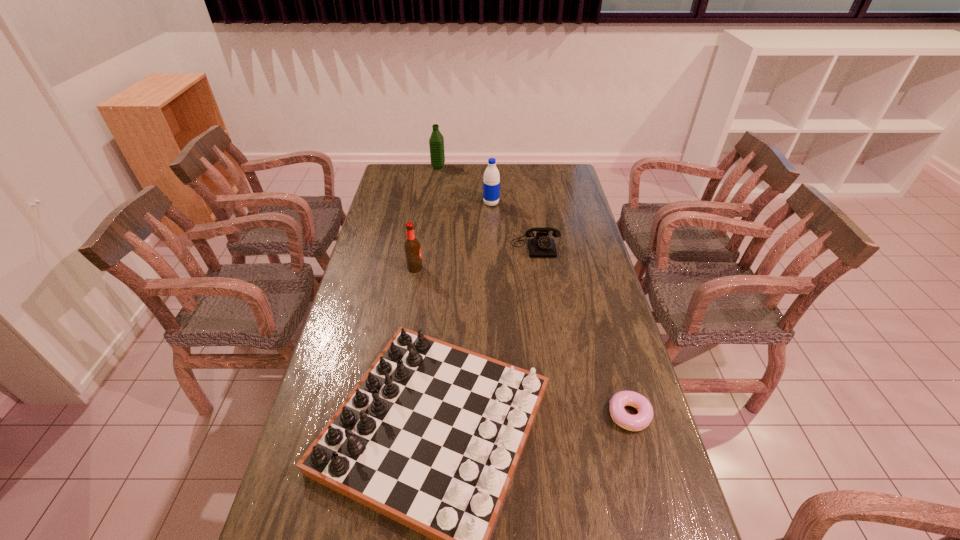
This screenshot has height=540, width=960. In order to click on the farther water bottle in this screenshot , I will do `click(436, 142)`.

This screenshot has height=540, width=960. I want to click on the farthest object, so click(x=436, y=142).

The width and height of the screenshot is (960, 540). I want to click on the nearer water bottle, so click(491, 184).

At what (x,y) coordinates should I click in order to perform the action: click on the right water bottle. Please return your answer as a coordinate pair (x, y). Looking at the image, I should click on (491, 184).

I want to click on the third nearest object, so click(x=412, y=247).

This screenshot has width=960, height=540. What are the coordinates of `telephone` in the screenshot? It's located at (541, 246).

This screenshot has width=960, height=540. I want to click on the second shortest object, so click(x=541, y=246).

Find the location of a particular element. doughnut is located at coordinates (640, 421).

What are the coordinates of `the rightmost object` in the screenshot? It's located at (640, 421).

Locate an element on the screen. The width and height of the screenshot is (960, 540). vacant space located 0.280m on the right of the farthest object is located at coordinates (500, 167).